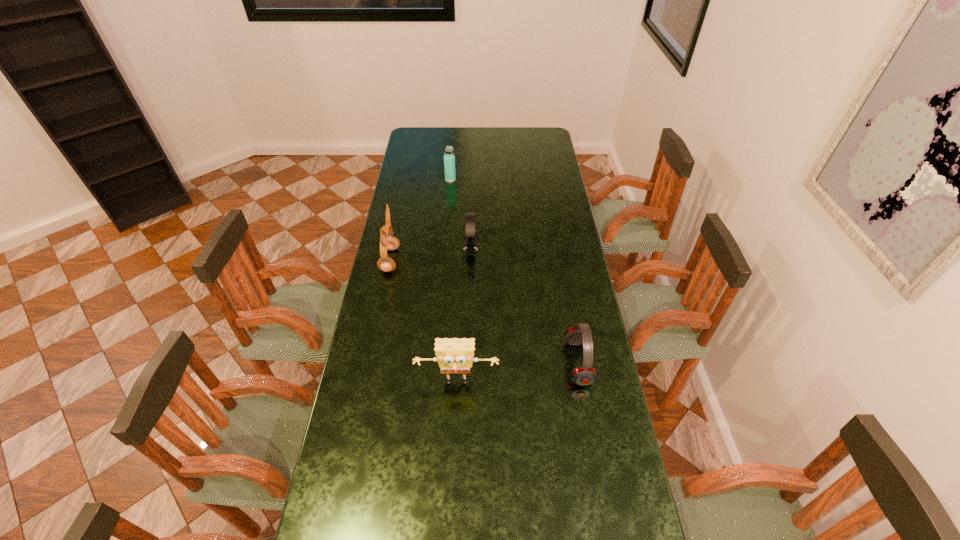
Where is `the tallest earphone`? the tallest earphone is located at coordinates (387, 241).

The image size is (960, 540). I want to click on the leftmost object, so click(387, 241).

You are a GUI agent. You are given a task and a screenshot of the screen. Output one action in this format:
    pyautogui.click(x=<x>, y=<y>)
    Task: Click on the sponge
    This screenshot has height=540, width=960.
    Given the screenshot: What is the action you would take?
    [454, 356]

Find the location of a particular element. The width and height of the screenshot is (960, 540). the farthest object is located at coordinates (449, 158).

What are the coordinates of `the second earphone from left to right` in the screenshot? It's located at (471, 234).

This screenshot has height=540, width=960. I want to click on the nearest earphone, so click(584, 375).

Find the location of a particular element. the rightmost earphone is located at coordinates (584, 375).

At what (x,y) coordinates should I click in order to perform the action: click on vacant space located on the front-facing side of the tallest object. Please return your answer as a coordinate pair (x, y). The width and height of the screenshot is (960, 540). Looking at the image, I should click on (451, 260).

At what (x,y) coordinates should I click in order to perform the action: click on blank space located 0.070m on the face of the sponge. Please return your answer as a coordinate pair (x, y). The height and width of the screenshot is (540, 960). Looking at the image, I should click on (456, 416).

Identify the location of blank space located on the front of the thermos bottle. (445, 236).